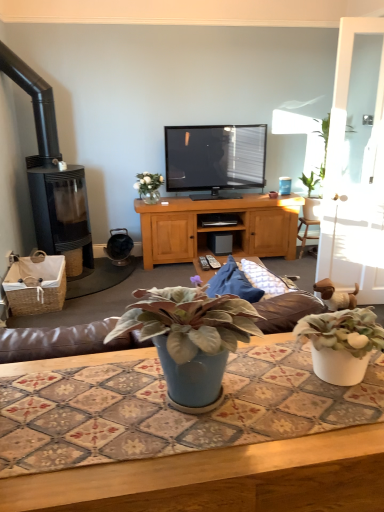
Where is `blue matte plant pot at center, the first houseplant when ordered from front to back`? blue matte plant pot at center, the first houseplant when ordered from front to back is located at coordinates (190, 338).

Identify the location of picnic basket in front of the translucent glass vase at upper center. Image resolution: width=384 pixels, height=512 pixels. (36, 285).

From a real-world perspective, is woven brown picnic basket at lower left on top of translucent glass vase at upper center?

No.

Considering the sizes of objects woven brown picnic basket at lower left and translucent glass vase at upper center in the image provided, who is thinner, woven brown picnic basket at lower left or translucent glass vase at upper center?

With smaller width is translucent glass vase at upper center.

Is woven brown picnic basket at lower left outside of translucent glass vase at upper center?

Indeed, woven brown picnic basket at lower left is completely outside translucent glass vase at upper center.

Is white plastic remote control at center, which is the second remote control from left to right, at the right side of white glass door at right?

No.

Is white plastic remote control at center, positioned as the first remote control in right-to-left order, looking in the opposite direction of white glass door at right?

No, white plastic remote control at center, positioned as the first remote control in right-to-left order, is not facing away from white glass door at right.

From the image's perspective, which object appears higher, white plastic remote control at center, which is the second remote control from left to right, or white glass door at right?

white glass door at right appears higher in the image.

How different are the orientations of white plastic remote control at center, positioned as the first remote control in right-to-left order, and white glass door at right in degrees?

white plastic remote control at center, positioned as the first remote control in right-to-left order, and white glass door at right are facing 77.8 degrees away from each other.

Which is less distant, (48, 231) or (141, 177)?

Positioned in front is point (48, 231).

Does black glass fireplace at left appear on the right side of translucent glass vase at upper center?

Incorrect, black glass fireplace at left is not on the right side of translucent glass vase at upper center.

How different are the orientations of black glass fireplace at left and translucent glass vase at upper center in degrees?

1.34 degrees.

Is there a large distance between black glass fireplace at left and translucent glass vase at upper center?

black glass fireplace at left is actually quite close to translucent glass vase at upper center.

Is woven brown picnic basket at lower left inside black glass fireplace at left?

No, woven brown picnic basket at lower left is located outside of black glass fireplace at left.

Based on the photo, from a real-world perspective, which object rests below the other?

woven brown picnic basket at lower left is physically lower.

Is black glass fireplace at left facing towards woven brown picnic basket at lower left?

Yes, black glass fireplace at left is aimed at woven brown picnic basket at lower left.

Can we say blue glossy coffee cup at upper right lies outside black plastic remote control at center, the 2th remote control when ordered from right to left?

Yes, blue glossy coffee cup at upper right is located beyond the bounds of black plastic remote control at center, the 2th remote control when ordered from right to left.

Is blue glossy coffee cup at upper right far from black plastic remote control at center, the 2th remote control when ordered from right to left?

Indeed, blue glossy coffee cup at upper right is not near black plastic remote control at center, the 2th remote control when ordered from right to left.

Is blue glossy coffee cup at upper right positioned before black plastic remote control at center, the 2th remote control when ordered from right to left?

No.

Considering the points (285, 194) and (208, 267), which point is behind, point (285, 194) or point (208, 267)?

Point (285, 194)

Is point (306, 177) in front of point (283, 178)?

That is True.

From a real-world perspective, who is located lower, green leafy plant at upper right, arranged as the first houseplant when viewed from the back, or blue glossy coffee cup at upper right?

blue glossy coffee cup at upper right, from a real-world perspective.

Between green leafy plant at upper right, which is the 1th houseplant in top-to-bottom order, and blue glossy coffee cup at upper right, which one has smaller width?

blue glossy coffee cup at upper right.

Is blue matte plant pot at center, placed as the 1th houseplant when sorted from left to right, completely or partially inside blue glossy coffee cup at upper right?

No, blue matte plant pot at center, placed as the 1th houseplant when sorted from left to right, is not a part of blue glossy coffee cup at upper right.

Based on the photo, how much distance is there between blue glossy coffee cup at upper right and blue matte plant pot at center, which is the first houseplant in bottom-to-top order?

The distance of blue glossy coffee cup at upper right from blue matte plant pot at center, which is the first houseplant in bottom-to-top order, is 11.48 feet.

In terms of height, does blue glossy coffee cup at upper right look taller or shorter compared to blue matte plant pot at center, the 2th houseplant viewed from the back?

In the image, blue glossy coffee cup at upper right appears to be shorter than blue matte plant pot at center, the 2th houseplant viewed from the back.

Is blue glossy coffee cup at upper right to the right of blue matte plant pot at center, the 2th houseplant viewed from the back, from the viewer's perspective?

Yes, blue glossy coffee cup at upper right is to the right of blue matte plant pot at center, the 2th houseplant viewed from the back.

Find the location of a particular element. picnic basket directly beneath the translucent glass vase at upper center (from a real-world perspective) is located at coordinates (36, 285).

Locate an element on the screen. glass door that appears behind the white plastic remote control at center, which is the second remote control from left to right is located at coordinates (354, 190).

From the image, which object appears to be nearer to green leafy plant at upper right, arranged as the first houseplant when viewed from the back, black glass fireplace at left or white plastic remote control at center, positioned as the first remote control in right-to-left order?

Based on the image, white plastic remote control at center, positioned as the first remote control in right-to-left order, appears to be nearer to green leafy plant at upper right, arranged as the first houseplant when viewed from the back.

Looking at the image, which one is located closer to blue ceramic table at center, translucent glass vase at upper center or white glass door at right?

The object closer to blue ceramic table at center is white glass door at right.

Looking at the image, which one is located closer to white plastic remote control at center, which is the second remote control from left to right, blue glossy coffee cup at upper right or black glass fireplace at left?

The object closer to white plastic remote control at center, which is the second remote control from left to right, is black glass fireplace at left.

From the image, which object appears to be nearer to blue ceramic table at center, blue glossy coffee cup at upper right or green leafy plant at upper right, arranged as the first houseplant when viewed from the back?

Among the two, blue glossy coffee cup at upper right is located nearer to blue ceramic table at center.

When comparing their distances from black plastic remote control at center, the first remote control viewed from the left, does green leafy plant at upper right, positioned as the 1th houseplant in right-to-left order, or translucent glass vase at upper center seem further?

The object further to black plastic remote control at center, the first remote control viewed from the left, is green leafy plant at upper right, positioned as the 1th houseplant in right-to-left order.

Based on their spatial positions, is blue matte plant pot at center, the second houseplant from the right, or black plastic remote control at center, the first remote control viewed from the left, closer to blue glossy coffee cup at upper right?

Based on the image, black plastic remote control at center, the first remote control viewed from the left, appears to be nearer to blue glossy coffee cup at upper right.

Considering their positions, is black plastic remote control at center, the first remote control viewed from the left, positioned closer to blue glossy coffee cup at upper right than black glass fireplace at left?

black glass fireplace at left lies closer to blue glossy coffee cup at upper right than the other object.

From the image, which object appears to be nearer to green leafy plant at upper right, acting as the 2th houseplant starting from the bottom, blue matte plant pot at center, acting as the second houseplant starting from the top, or translucent glass vase at upper center?

translucent glass vase at upper center is closer to green leafy plant at upper right, acting as the 2th houseplant starting from the bottom.

Locate an element on the screen. table located between blue matte plant pot at center, which is the first houseplant in bottom-to-top order, and woven brown picnic basket at lower left in the depth direction is located at coordinates (222, 478).

In order to click on table between black glass fireplace at left and white glass door at right in the horizontal direction in this screenshot , I will do `click(222, 478)`.

This screenshot has width=384, height=512. I want to click on table located between blue matte plant pot at center, which is the first houseplant in bottom-to-top order, and blue glossy coffee cup at upper right in the depth direction, so click(222, 478).

Identify the location of glass door between blue matte plant pot at center, which is the first houseplant in bottom-to-top order, and green leafy plant at upper right, positioned as the 1th houseplant in right-to-left order, from front to back. (354, 190).